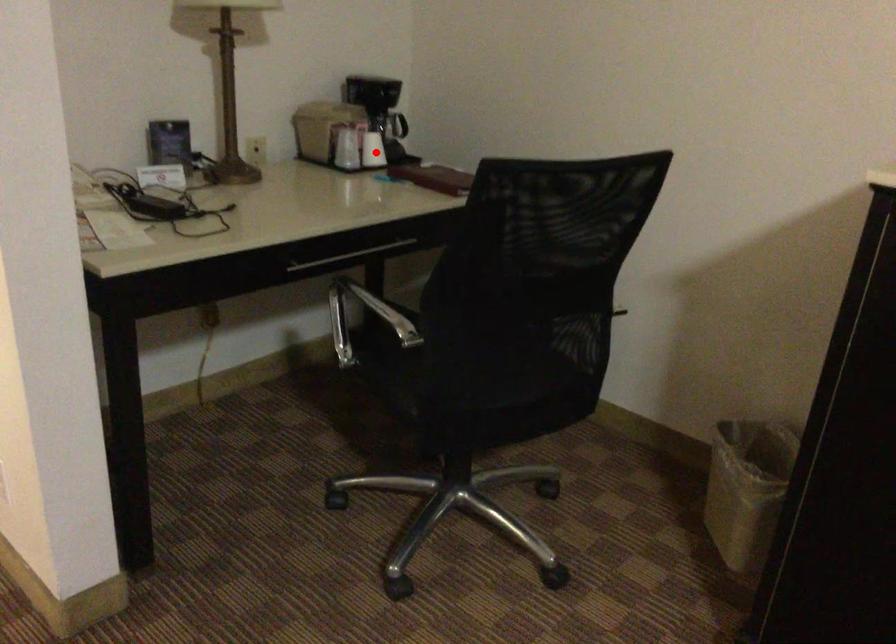
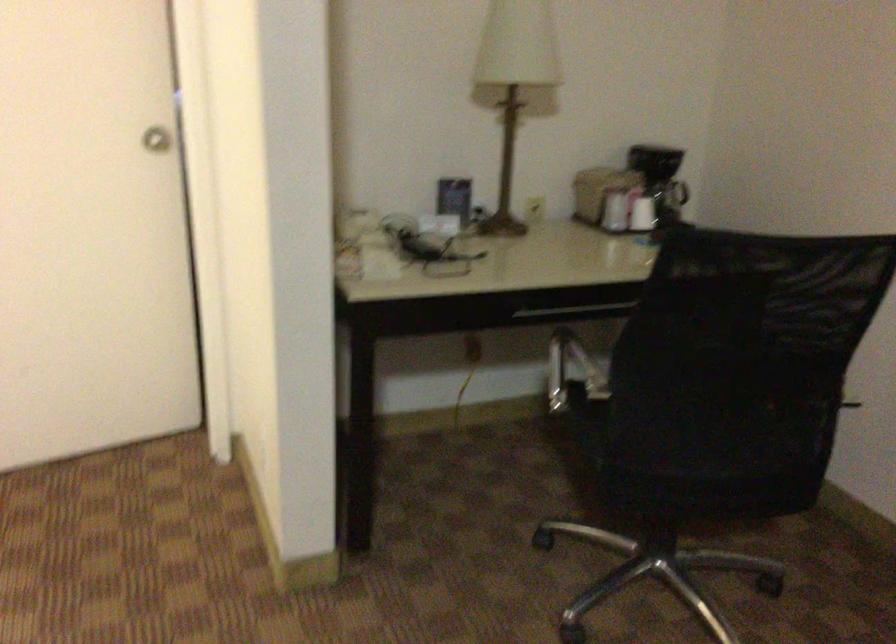
Where in the second image is the point corresponding to the highlighted location from the first image?

(642, 214)